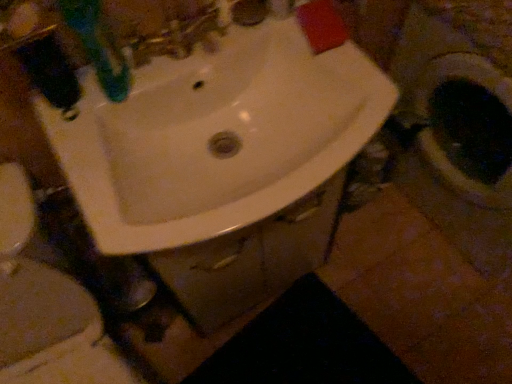
Describe the element at coordinates (304, 345) in the screenshot. This screenshot has width=512, height=384. I see `black matte rug at lower center` at that location.

This screenshot has width=512, height=384. Describe the element at coordinates (46, 307) in the screenshot. I see `white glossy toilet at center` at that location.

Find the location of a particular element. white glossy toilet at center is located at coordinates (46, 307).

Measure the distance between white glossy sink at center and camera.

They are 22.08 inches apart.

In the scene shown: What is the approximate height of green plastic toothbrush at upper left?

green plastic toothbrush at upper left is 23.04 centimeters in height.

The image size is (512, 384). What are the coordinates of `black matte rug at lower center` in the screenshot? It's located at (304, 345).

Which object is positioned more to the right, black matte rug at lower center or white glossy sink at center?

black matte rug at lower center.

You are a GUI agent. You are given a task and a screenshot of the screen. Output one action in this format:
    pyautogui.click(x=<x>, y=<y>)
    Task: Click on the dark beneath the white glossy sink at center (from a real-world perspective)
    The width and height of the screenshot is (512, 384).
    Given the screenshot: What is the action you would take?
    pyautogui.click(x=304, y=345)

From the picture: Considering the relative sizes of black matte rug at lower center and white glossy sink at center in the image provided, is black matte rug at lower center bigger than white glossy sink at center?

No.

From a real-world perspective, is green plastic toothbrush at upper left located higher than white glossy toilet at center?

Yes, from a real-world perspective, green plastic toothbrush at upper left is over white glossy toilet at center

Is point (82, 29) positioned behind point (65, 284)?

That is False.

Are green plastic toothbrush at upper left and white glossy toilet at center located far from each other?

No, green plastic toothbrush at upper left is not far away from white glossy toilet at center.

How distant is green plastic toothbrush at upper left from white glossy toilet at center?

green plastic toothbrush at upper left is 16.15 inches away from white glossy toilet at center.

Considering the sizes of objects white glossy toilet at center and black matte rug at lower center in the image provided, who is smaller, white glossy toilet at center or black matte rug at lower center?

black matte rug at lower center.

Is white glossy toilet at center at the left side of black matte rug at lower center?

Yes.

In terms of width, does white glossy toilet at center look wider or thinner when compared to black matte rug at lower center?

Clearly, white glossy toilet at center has more width compared to black matte rug at lower center.

Is white glossy toilet at center aimed at black matte rug at lower center?

No, white glossy toilet at center is not turned towards black matte rug at lower center.

From a real-world perspective, is black matte rug at lower center on white glossy toilet at center?

Actually, black matte rug at lower center is physically below white glossy toilet at center in the real world.

Does black matte rug at lower center appear on the left side of white glossy toilet at center?

No.

How many degrees apart are the facing directions of black matte rug at lower center and white glossy toilet at center?

15.2 degrees separate the facing orientations of black matte rug at lower center and white glossy toilet at center.

Which is correct: black matte rug at lower center is inside white glossy toilet at center, or outside of it?

black matte rug at lower center is not inside white glossy toilet at center, it's outside.

Is point (318, 363) positioned behind point (82, 3)?

Yes, it is.

Is black matte rug at lower center outside of green plastic toothbrush at upper left?

Indeed, black matte rug at lower center is completely outside green plastic toothbrush at upper left.

I want to click on dark that is on the right side of green plastic toothbrush at upper left, so click(x=304, y=345).

Which object is positioned more to the left, black matte rug at lower center or green plastic toothbrush at upper left?

From the viewer's perspective, green plastic toothbrush at upper left appears more on the left side.

Would you say white glossy sink at center is inside or outside green plastic toothbrush at upper left?

white glossy sink at center is not inside green plastic toothbrush at upper left, it's outside.

Does white glossy sink at center come behind green plastic toothbrush at upper left?

Yes, it is.

From the image's perspective, which object appears higher, white glossy sink at center or green plastic toothbrush at upper left?

green plastic toothbrush at upper left appears higher in the image.

Between point (321, 154) and point (58, 7), which one is positioned in front?

Point (58, 7)

There is a black matte rug at lower center. At what (x,y) coordinates should I click in order to perform the action: click on sink above it (from a real-world perspective). Please return your answer as a coordinate pair (x, y). This screenshot has width=512, height=384. Looking at the image, I should click on (220, 133).

Is white glossy sink at center turned away from black matte rug at lower center?

No, white glossy sink at center is not facing away from black matte rug at lower center.

Relative to black matte rug at lower center, is white glossy sink at center in front or behind?

Visually, white glossy sink at center is located in front of black matte rug at lower center.

From a real-world perspective, who is located lower, white glossy sink at center or black matte rug at lower center?

From a 3D spatial view, black matte rug at lower center is below.

Where is `dark below the white glossy sink at center (from a real-world perspective)`? This screenshot has height=384, width=512. dark below the white glossy sink at center (from a real-world perspective) is located at coordinates (304, 345).

Where is `toilet on the left of green plastic toothbrush at upper left`? toilet on the left of green plastic toothbrush at upper left is located at coordinates (46, 307).

When comparing their distances from white glossy sink at center, does black matte rug at lower center or white glossy toilet at center seem further?

The object further to white glossy sink at center is black matte rug at lower center.

When comparing their distances from white glossy sink at center, does green plastic toothbrush at upper left or black matte rug at lower center seem closer?

green plastic toothbrush at upper left is closer to white glossy sink at center.

Looking at this image, which object lies further to the anchor point black matte rug at lower center, green plastic toothbrush at upper left or white glossy sink at center?

green plastic toothbrush at upper left lies further to black matte rug at lower center than the other object.

When comparing their distances from white glossy sink at center, does green plastic toothbrush at upper left or white glossy toilet at center seem closer?

Based on the image, green plastic toothbrush at upper left appears to be nearer to white glossy sink at center.

Which object lies further to the anchor point white glossy toilet at center, green plastic toothbrush at upper left or white glossy sink at center?

The object further to white glossy toilet at center is green plastic toothbrush at upper left.

Based on their spatial positions, is white glossy toilet at center or white glossy sink at center further from black matte rug at lower center?

white glossy sink at center is positioned further to the anchor black matte rug at lower center.

From the image, which object appears to be farther from white glossy toilet at center, green plastic toothbrush at upper left or black matte rug at lower center?

black matte rug at lower center lies further to white glossy toilet at center than the other object.

When comparing their distances from white glossy toilet at center, does black matte rug at lower center or white glossy sink at center seem closer?

Among the two, white glossy sink at center is located nearer to white glossy toilet at center.

At what (x,y) coordinates should I click in order to perform the action: click on sink between green plastic toothbrush at upper left and black matte rug at lower center vertically. Please return your answer as a coordinate pair (x, y). Image resolution: width=512 pixels, height=384 pixels. Looking at the image, I should click on (220, 133).

This screenshot has height=384, width=512. I want to click on sink between white glossy toilet at center and black matte rug at lower center in the front-back direction, so click(x=220, y=133).

Find the location of a particular element. sink between green plastic toothbrush at upper left and white glossy toilet at center in the vertical direction is located at coordinates (220, 133).

Identify the location of toilet between green plastic toothbrush at upper left and black matte rug at lower center in the vertical direction. The width and height of the screenshot is (512, 384). (46, 307).